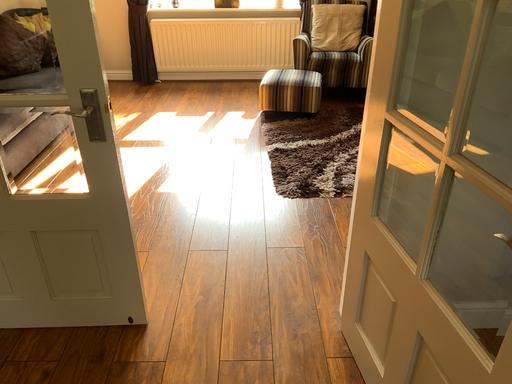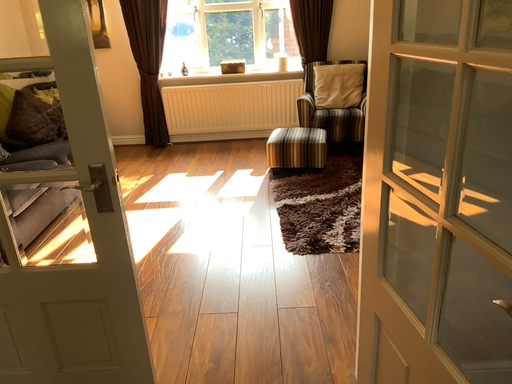
Question: How did the camera likely rotate when shooting the video?

Choices:
 (A) rotated downward
 (B) rotated upward

Answer: (B)